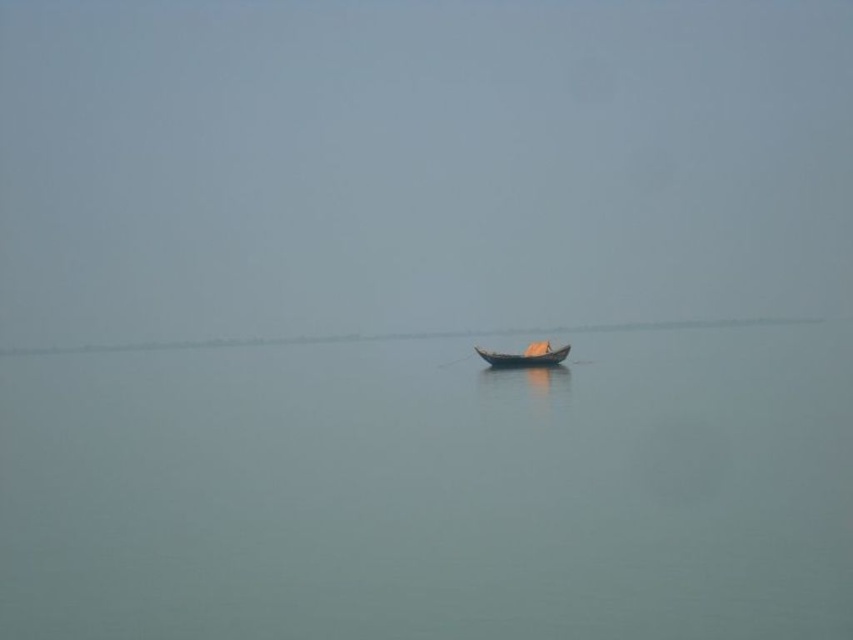
Question: Among these points, which one is nearest to the camera?

Choices:
 (A) (329, 548)
 (B) (543, 364)

Answer: (A)

Question: Which is farther from the foggy mist at center?

Choices:
 (A) smooth water at center
 (B) wooden boat at center

Answer: (B)

Question: Is foggy mist at center below wooden boat at center?

Choices:
 (A) no
 (B) yes

Answer: (A)

Question: Can you confirm if smooth water at center is positioned above wooden boat at center?

Choices:
 (A) no
 (B) yes

Answer: (A)

Question: Is foggy mist at center positioned at the back of smooth water at center?

Choices:
 (A) no
 (B) yes

Answer: (B)

Question: Which point is farther to the camera?

Choices:
 (A) wooden boat at center
 (B) smooth water at center
 (C) foggy mist at center

Answer: (C)